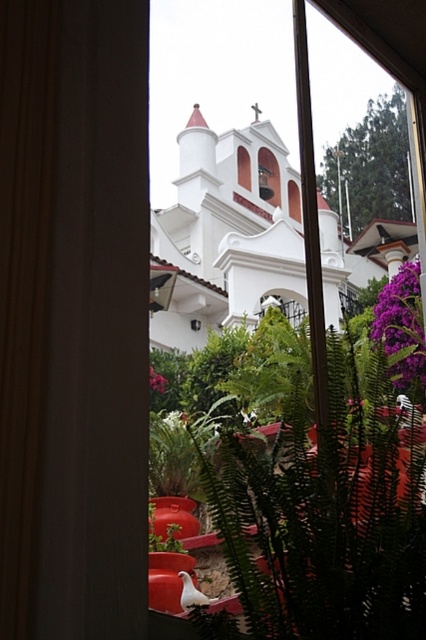
Question: Which point appears farthest from the camera in this image?

Choices:
 (A) (227, 321)
 (B) (181, 605)
 (C) (152, 380)

Answer: (A)

Question: Can you confirm if purple matte flower at right is smaller than purple matte flower at center?

Choices:
 (A) yes
 (B) no

Answer: (A)

Question: Is white glossy bird at lower center to the left of purple matte flower at center from the viewer's perspective?

Choices:
 (A) no
 (B) yes

Answer: (A)

Question: Which of these objects is positioned farthest from the white glossy bird at lower center?

Choices:
 (A) purple matte flower at right
 (B) white matte church at center

Answer: (B)

Question: In this image, where is white matte church at center located relative to white glossy bird at lower center?

Choices:
 (A) below
 (B) above

Answer: (B)

Question: Which object appears farthest from the camera in this image?

Choices:
 (A) white glossy bird at lower center
 (B) purple matte flower at right

Answer: (B)